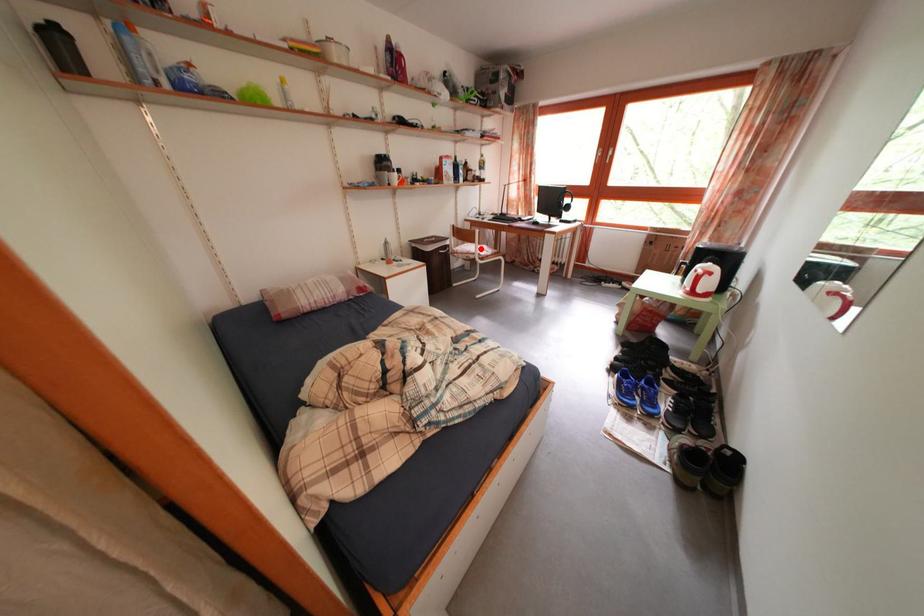
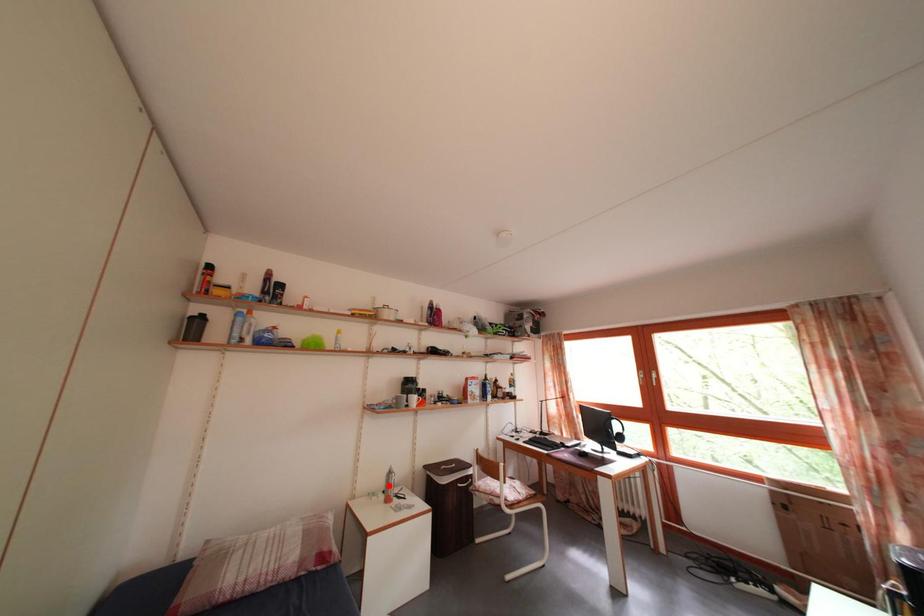
I am providing you with two images of the same scene from different viewpoints. A red point is marked on the first image and another point is marked on the second image. Is the red point in image1 aligned with the point shown in image2?

No